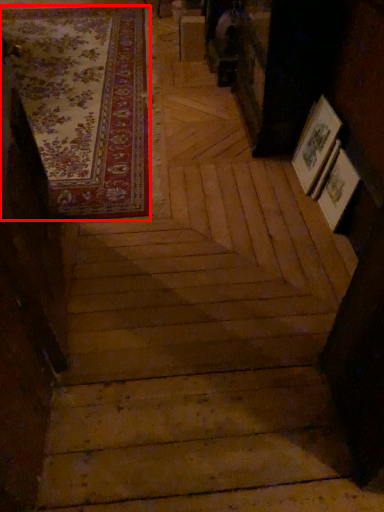
Question: In this image, where is mat (annotated by the red box) located relative to stairwell?

Choices:
 (A) left
 (B) right

Answer: (A)